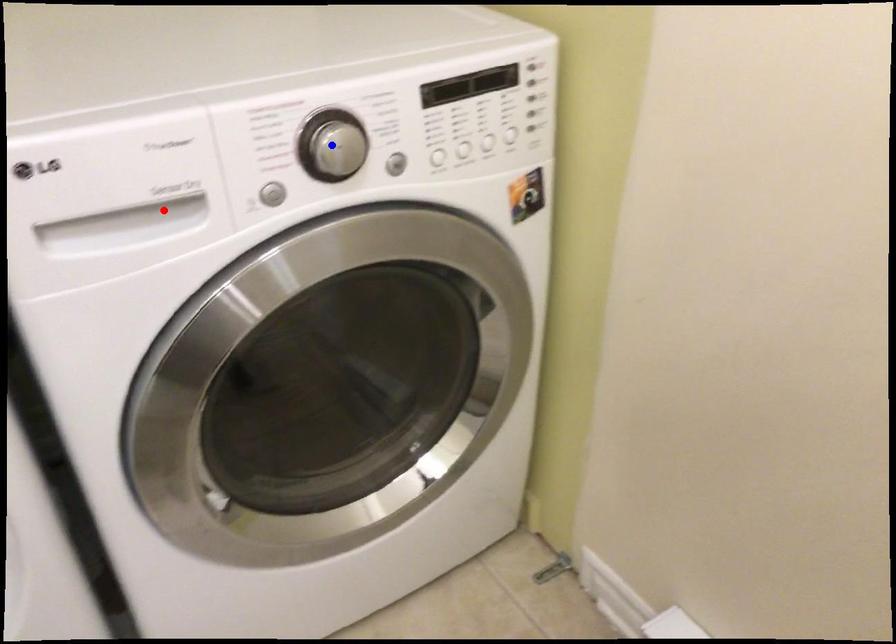
Question: Two points are marked on the image. Which point is closer to the camera?

Choices:
 (A) Blue point is closer.
 (B) Red point is closer.

Answer: (B)